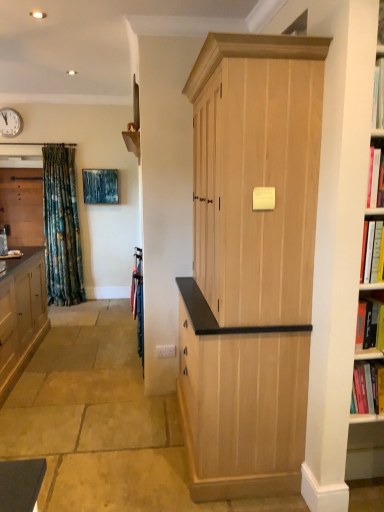
This screenshot has width=384, height=512. In order to click on free point below wooden shelf at upper center (from a real-world perspective) in this screenshot , I will do `click(133, 351)`.